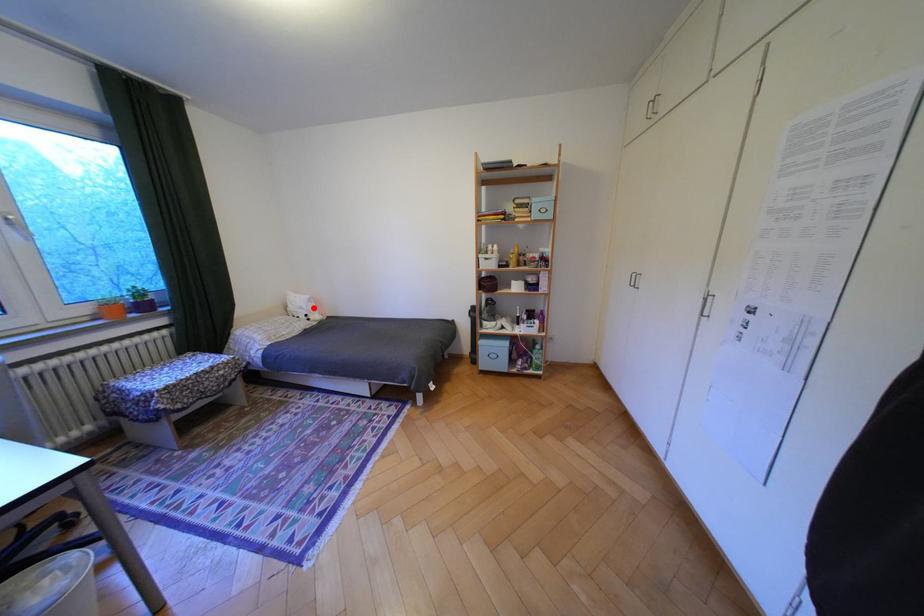
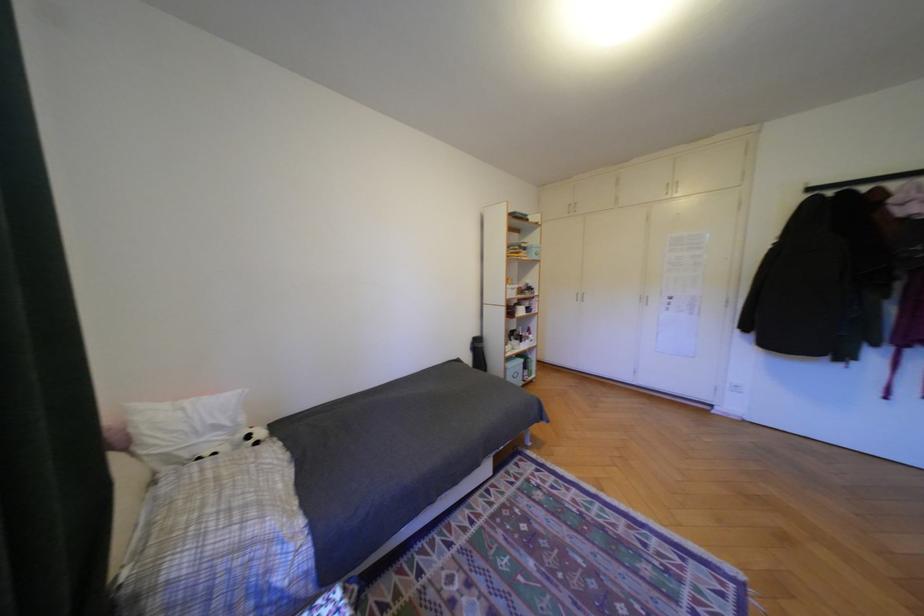
Where in the second image is the point corresponding to the highlighted location from the first image?

(228, 427)